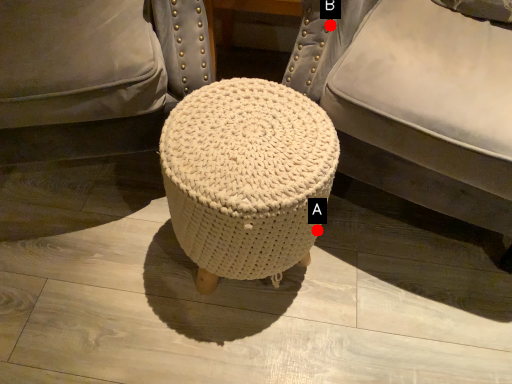
Question: Two points are circled on the image, labeled by A and B beside each circle. Which point is closer to the camera taking this photo?

Choices:
 (A) A is closer
 (B) B is closer

Answer: (B)